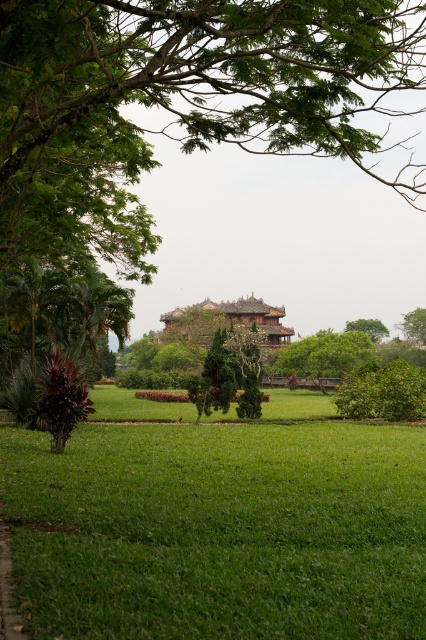
Based on the photo, between brown wooden palace at center and green leafy tree at upper center, which one is positioned higher?

green leafy tree at upper center is above.

Is the position of brown wooden palace at center more distant than that of green leafy tree at upper center?

No, it is not.

Which is behind, point (273, 308) or point (363, 317)?

Point (363, 317)

Image resolution: width=426 pixels, height=640 pixels. Identify the location of brown wooden palace at center. (222, 323).

Does brown wooden palace at center appear over green textured tree at center?

Yes.

Does brown wooden palace at center come behind green textured tree at center?

Yes, it is.

What do you see at coordinates (222, 323) in the screenshot? I see `brown wooden palace at center` at bounding box center [222, 323].

You are a GUI agent. You are given a task and a screenshot of the screen. Output one action in this format:
    pyautogui.click(x=<x>, y=<y>)
    Task: Click on the brown wooden palace at center
    The height and width of the screenshot is (640, 426).
    Given the screenshot: What is the action you would take?
    pyautogui.click(x=222, y=323)

Is green textured tree at center closer to the viewer compared to green leafy tree at upper right?

Yes.

Measure the distance between point [224,378] and camera.

Point [224,378] is 138.68 feet away from camera.

The height and width of the screenshot is (640, 426). Find the location of `green textured tree at center`. green textured tree at center is located at coordinates (213, 380).